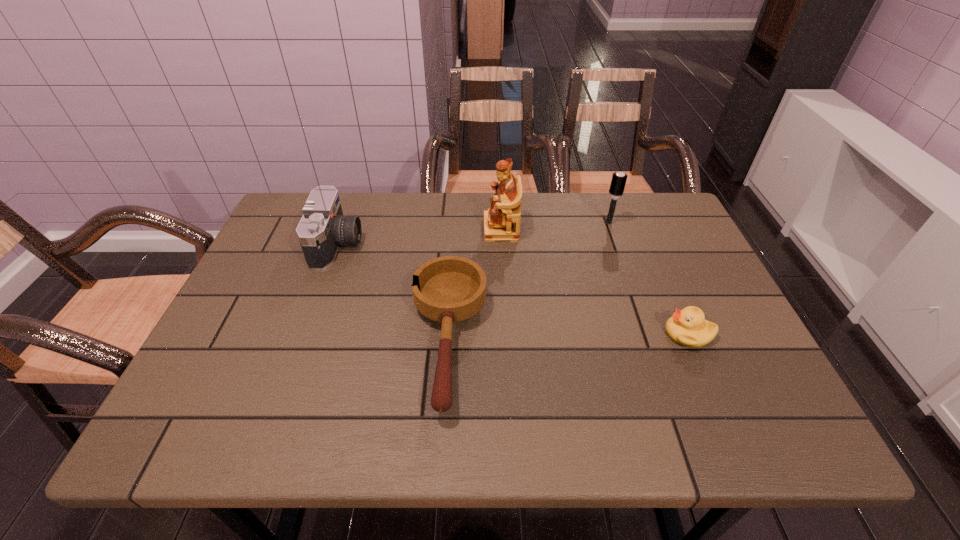
Identify the location of object that is positioned at the right edge. This screenshot has width=960, height=540. (688, 327).

The width and height of the screenshot is (960, 540). Find the location of `object that is at the far left corner`. object that is at the far left corner is located at coordinates (323, 228).

In the image, there is a desktop. Identify the location of vacant region at the far edge. (428, 208).

In the image, there is a desktop. Find the location of `vacant area at the near edge`. vacant area at the near edge is located at coordinates (344, 438).

Where is `free space at the left edge of the desktop`? The width and height of the screenshot is (960, 540). free space at the left edge of the desktop is located at coordinates (282, 281).

The width and height of the screenshot is (960, 540). In order to click on free space at the right edge of the desktop in this screenshot , I will do `click(720, 375)`.

Locate an element on the screen. blank region between the camera and the saucepan is located at coordinates (393, 293).

What are the coordinates of `vacant area between the rightmost object and the camera` in the screenshot? It's located at (513, 289).

The image size is (960, 540). I want to click on free space between the saucepan and the rightmost object, so point(568,338).

The width and height of the screenshot is (960, 540). Find the location of `free area in between the fourth object from left to right and the duckling`. free area in between the fourth object from left to right and the duckling is located at coordinates (649, 278).